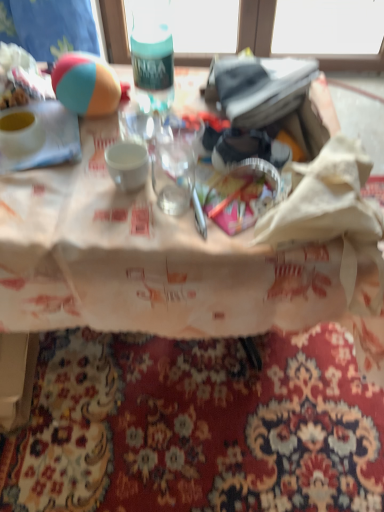
At what (x,y) coordinates should I click in order to perform the action: click on free space in front of tri-color rubber ball at upper left. Please return your answer as a coordinate pair (x, y). Looking at the image, I should click on (83, 160).